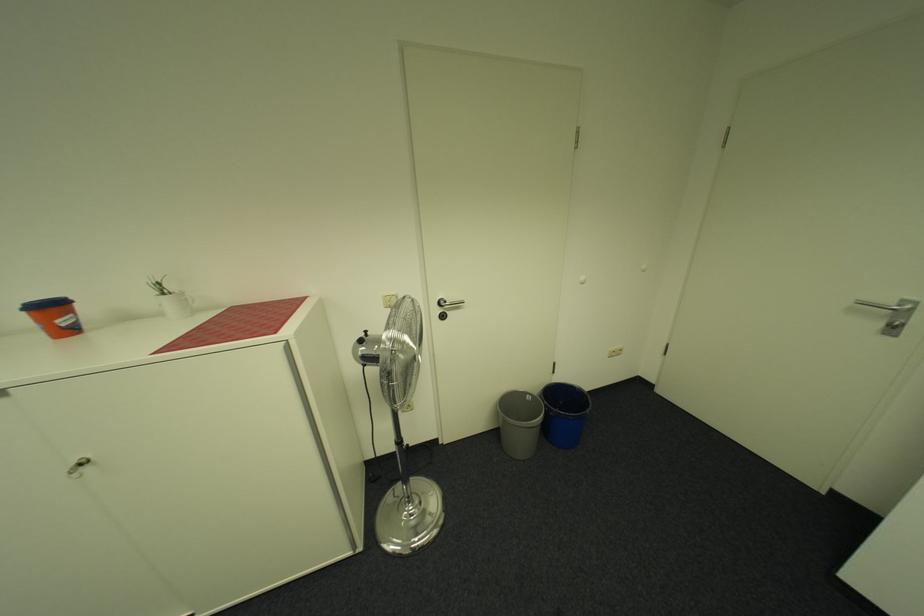
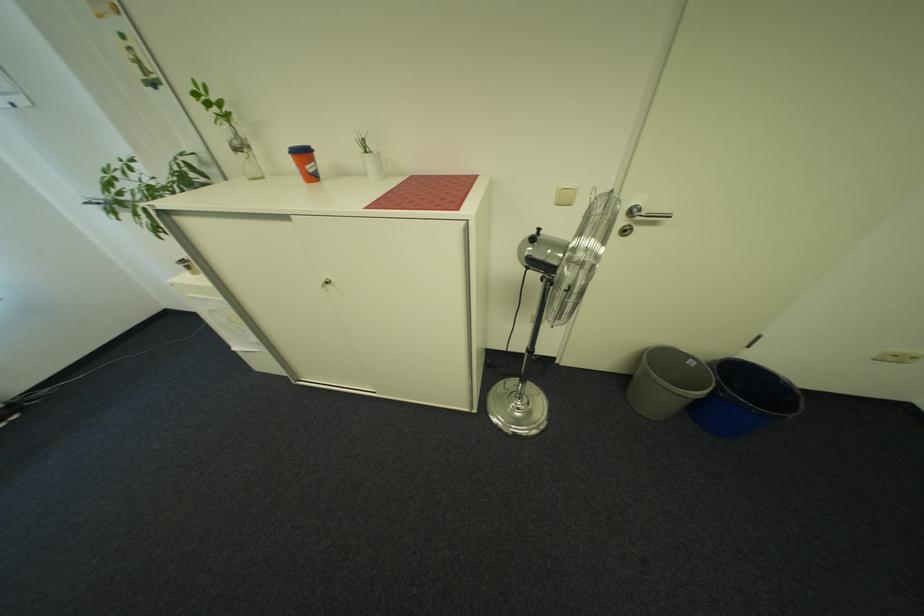
The point at (173, 294) is marked in the first image. Where is the corresponding point in the second image?

(375, 153)